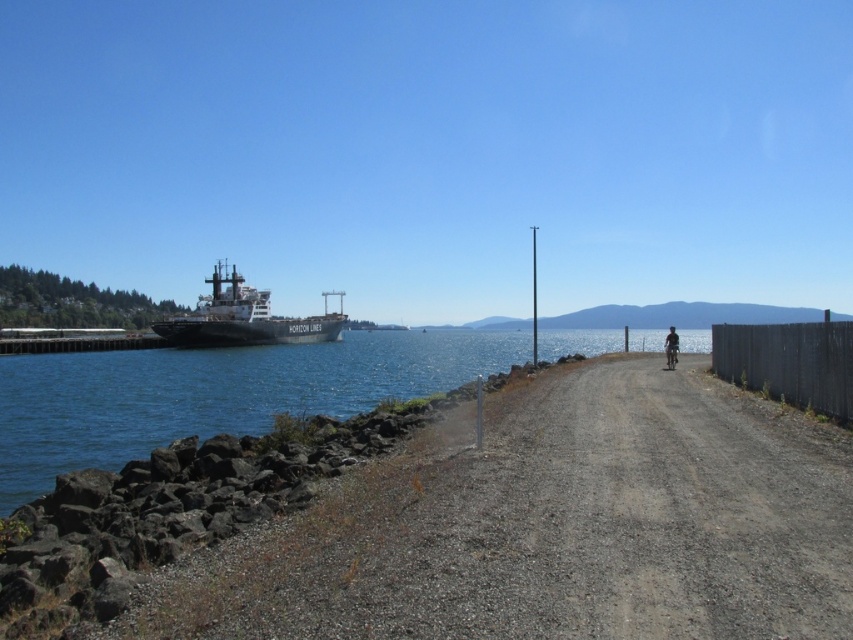
You are a delivery person trying to deliver a package to the white matte cargo ship at left. You are currently standing next to the black wooden fence at right. Can you see the ship from your current position? Explain why or why not based on the objects in the scene.

The black wooden fence at right is shorter than the white matte cargo ship at left. Since the fence is lower, you can see the ship over the fence. Therefore, yes, you can see the white matte cargo ship at left from your position next to the black wooden fence at right.

You are standing at the point closer to the camera in the image. Which point are you at, point (706, 572) or point (199, 314)?

You are at point (706, 572) because it is closer to the camera than point (199, 314).